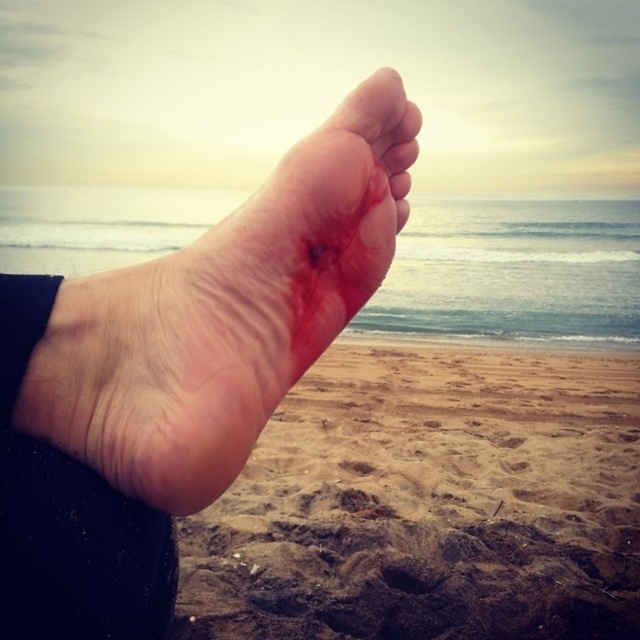
Question: Among these objects, which one is farthest from the camera?

Choices:
 (A) dry skin at center
 (B) brown sandy beach at lower center
 (C) dry skin foot at center

Answer: (B)

Question: Which of the following is the closest to the observer?

Choices:
 (A) dry skin at center
 (B) brown sandy beach at lower center
 (C) dry skin foot at center

Answer: (C)

Question: From the image, what is the correct spatial relationship of dry skin foot at center in relation to dry skin at center?

Choices:
 (A) below
 (B) above

Answer: (A)

Question: Does brown sandy beach at lower center appear over dry skin foot at center?

Choices:
 (A) yes
 (B) no

Answer: (B)

Question: Can you confirm if brown sandy beach at lower center is bigger than dry skin foot at center?

Choices:
 (A) yes
 (B) no

Answer: (A)

Question: Which object appears farthest from the camera in this image?

Choices:
 (A) dry skin foot at center
 (B) brown sandy beach at lower center
 (C) dry skin at center

Answer: (B)